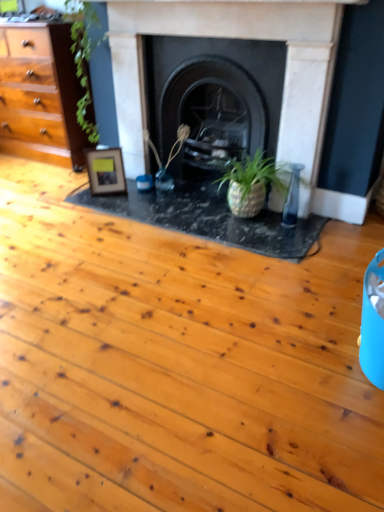
Question: Would you say black stone fireplace at center, the 2th fireplace when ordered from left to right, is outside wooden photo frame at center left?

Choices:
 (A) yes
 (B) no

Answer: (A)

Question: Considering the relative sizes of black stone fireplace at center, the 2th fireplace when ordered from left to right, and wooden photo frame at center left in the image provided, is black stone fireplace at center, the 2th fireplace when ordered from left to right, smaller than wooden photo frame at center left?

Choices:
 (A) yes
 (B) no

Answer: (B)

Question: Is black stone fireplace at center, the 2th fireplace when ordered from left to right, looking in the opposite direction of wooden photo frame at center left?

Choices:
 (A) no
 (B) yes

Answer: (A)

Question: Is black stone fireplace at center, arranged as the first fireplace when viewed from the right, thinner than wooden photo frame at center left?

Choices:
 (A) no
 (B) yes

Answer: (A)

Question: Does black stone fireplace at center, the 2th fireplace when ordered from left to right, turn towards wooden photo frame at center left?

Choices:
 (A) no
 (B) yes

Answer: (A)

Question: Is black stone fireplace at center, the 2th fireplace when ordered from left to right, taller than wooden photo frame at center left?

Choices:
 (A) yes
 (B) no

Answer: (A)

Question: Can you confirm if green matte plant at center is smaller than marble fireplace at center, the second fireplace in the right-to-left sequence?

Choices:
 (A) yes
 (B) no

Answer: (A)

Question: From a real-world perspective, is green matte plant at center physically below marble fireplace at center, which ranks as the 1th fireplace in left-to-right order?

Choices:
 (A) no
 (B) yes

Answer: (B)

Question: From a real-world perspective, is green matte plant at center positioned over marble fireplace at center, the second fireplace in the right-to-left sequence, based on gravity?

Choices:
 (A) no
 (B) yes

Answer: (A)

Question: From the image's perspective, is green matte plant at center below marble fireplace at center, the second fireplace in the right-to-left sequence?

Choices:
 (A) yes
 (B) no

Answer: (A)

Question: Is green matte plant at center closer to camera compared to marble fireplace at center, which ranks as the 1th fireplace in left-to-right order?

Choices:
 (A) yes
 (B) no

Answer: (B)

Question: Is marble fireplace at center, the second fireplace in the right-to-left sequence, completely or partially inside green matte plant at center?

Choices:
 (A) yes
 (B) no

Answer: (B)

Question: Considering the relative sizes of black stone fireplace at center, the 2th fireplace when ordered from left to right, and marble fireplace at center, the second fireplace in the right-to-left sequence, in the image provided, is black stone fireplace at center, the 2th fireplace when ordered from left to right, wider than marble fireplace at center, the second fireplace in the right-to-left sequence,?

Choices:
 (A) no
 (B) yes

Answer: (B)